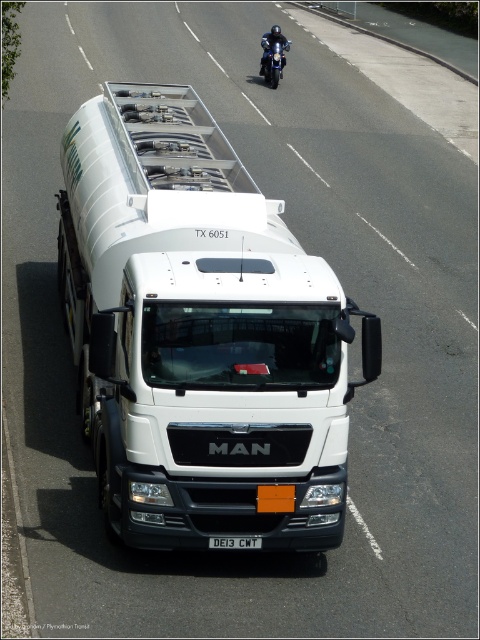
You are a driver who needs to park your truck in a designated area. The parking spot has a maximum length of 5 meters. Can you determine if the white glossy tanker at center will fit in the parking spot based on its position at point (200, 333)?

The point (200, 333) corresponds to the white glossy tanker at center, but there is no information provided about the truck length or the parking spot dimensions relative to the point coordinates. Therefore, it is impossible to determine if the truck will fit in the parking spot based on the given information.

You are a traffic officer observing a white MAN fuel tanker truck. You notice the white glossy tanker at center and the white plastic license plate at center. Which object is positioned higher from the ground?

The white glossy tanker at center is above the white plastic license plate at center, so the white glossy tanker at center is positioned higher from the ground.

You are standing on the side of the road watching the MAN fuel tanker truck. You notice two points marked on the truck. Which point is closer to you, point (236,545) or point (265,36)?

Point (236,545) is closer to the viewer than point (265,36).